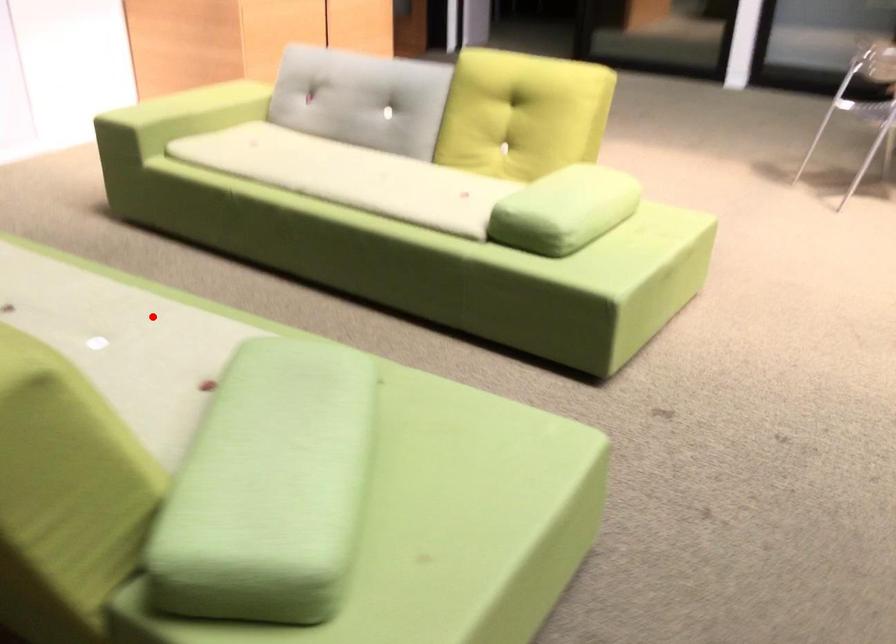
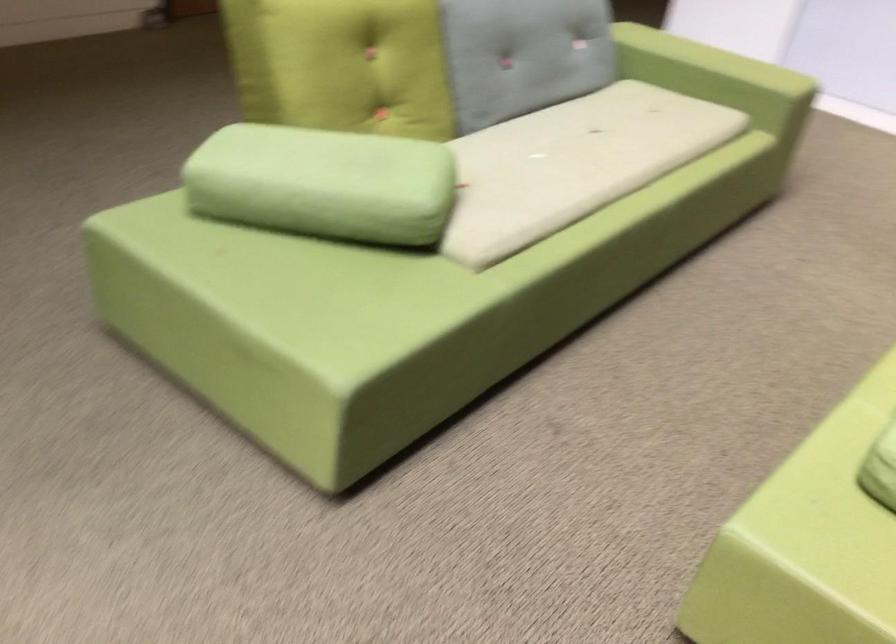
Question: I am providing you with two images of the same scene from different viewpoints. Given a red point in image1, look at the same physical point in image2. Is it:

Choices:
 (A) Closer to the viewpoint
 (B) Farther from the viewpoint

Answer: (B)